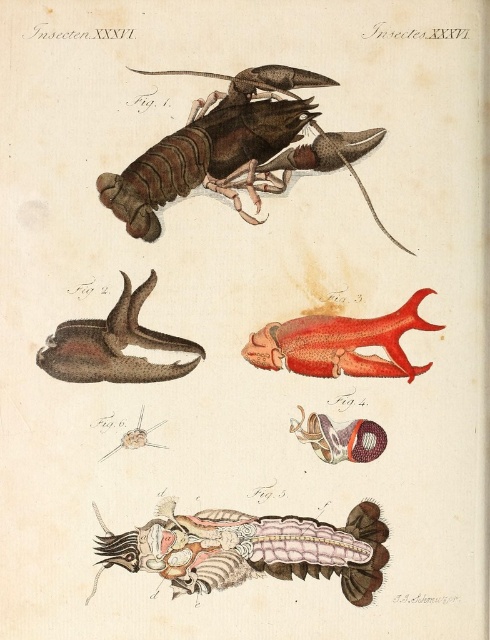
Question: Does brown matte lobster at upper center lie behind translucent pink exoskeleton at bottom center?

Choices:
 (A) no
 (B) yes

Answer: (B)

Question: Which point is closer to the camera?

Choices:
 (A) (98, 516)
 (B) (317, 168)

Answer: (A)

Question: Which of the following is the farthest from the observer?

Choices:
 (A) tap(156, 220)
 (B) tap(263, 541)

Answer: (A)

Question: Can you confirm if brown matte lobster at upper center is wider than translucent pink exoskeleton at bottom center?

Choices:
 (A) no
 (B) yes

Answer: (B)

Question: Is brown matte lobster at upper center closer to camera compared to translucent pink exoskeleton at bottom center?

Choices:
 (A) no
 (B) yes

Answer: (A)